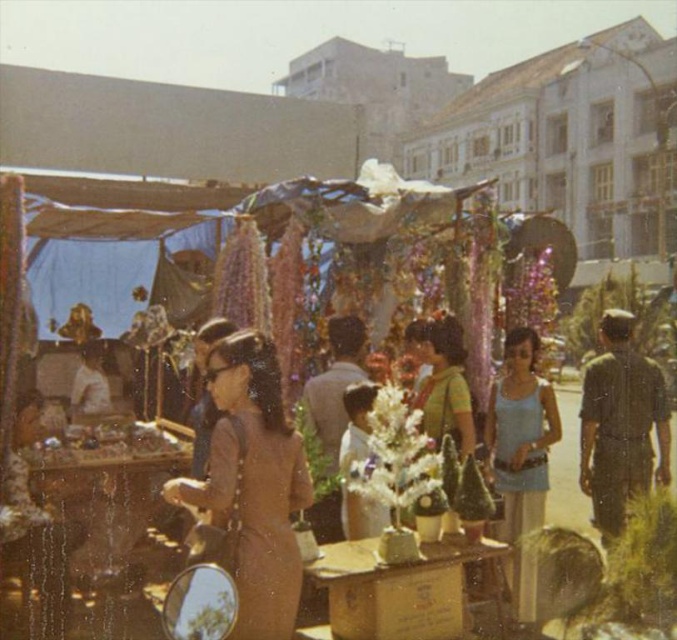
Based on the coordinates provided, which object is located at the point with coordinates (619, 424)?

The dark green uniform at right is located at the point with coordinates (619, 424).

You are a photographer at the market and want to capture both the brown matte dress at center and the dark green uniform at right in a single shot. Which object should you focus on first to ensure both are in frame?

The brown matte dress at center is located above the dark green uniform at right, so you should focus on the dark green uniform at right first to ensure both are in frame.

In the scene shown: You are a photographer at the market and want to capture both the brown matte dress at center and the dark green uniform at right in your photo. Which clothing item will appear shorter in the photo?

The brown matte dress at center will appear shorter in the photo because it is not as tall as the dark green uniform at right.